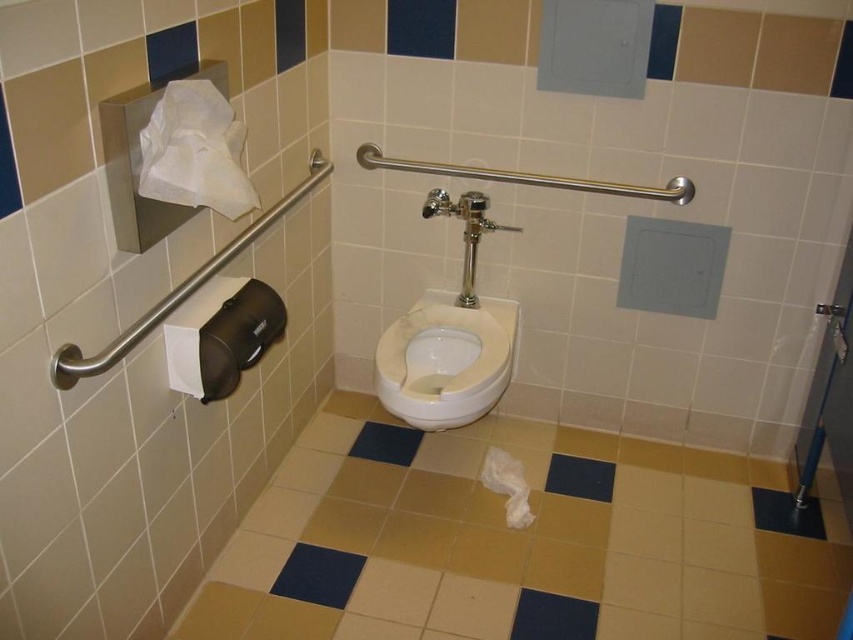
Question: Which of these objects is positioned closest to the white fluffy toilet paper at lower center?

Choices:
 (A) white paper towel at upper left
 (B) white matte toilet paper at left
 (C) white glossy toilet bowl at center

Answer: (C)

Question: Which object appears closest to the camera in this image?

Choices:
 (A) white fluffy toilet paper at lower center
 (B) white paper towel at upper left
 (C) white glossy toilet bowl at center

Answer: (B)

Question: Which object appears farthest from the camera in this image?

Choices:
 (A) white matte toilet paper at left
 (B) white fluffy toilet paper at lower center

Answer: (B)

Question: Considering the relative positions of white matte toilet paper at left and white fluffy toilet paper at lower center in the image provided, where is white matte toilet paper at left located with respect to white fluffy toilet paper at lower center?

Choices:
 (A) below
 (B) above

Answer: (B)

Question: Does white paper towel at upper left have a lesser width compared to white matte toilet paper at left?

Choices:
 (A) no
 (B) yes

Answer: (B)

Question: Can you confirm if white paper towel at upper left is positioned to the left of white fluffy toilet paper at lower center?

Choices:
 (A) yes
 (B) no

Answer: (A)